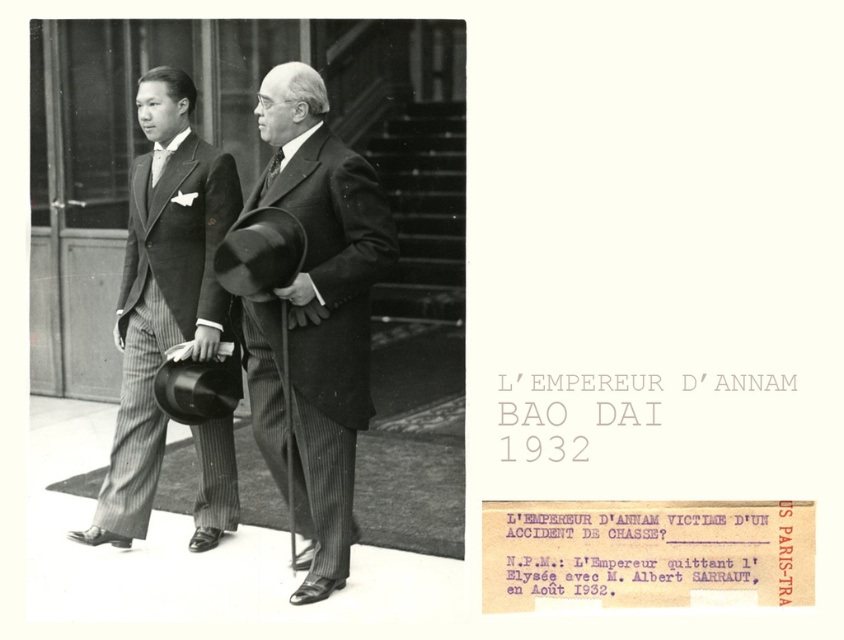
You are a tailor observing two men in the image. You need to determine which item, the matte black suit at left or the matte black tie at left, requires more vertical space in the fitting room. Based on their sizes, which one would need more space?

The matte black suit at left is much taller than the matte black tie at left, so it requires more vertical space in the fitting room.

You are standing in front of the building in the image and see two points marked on the ground. The first point is at coordinates point (339, 228) and the second is at point (157, 148). Which point is closer to you?

Point (339, 228) is closer to the viewer than point (157, 148).